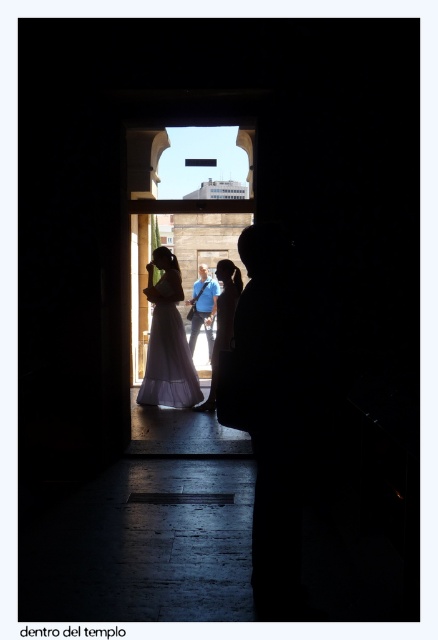
Question: Is white tulle dress at center to the left of blue fabric shirt at center from the viewer's perspective?

Choices:
 (A) no
 (B) yes

Answer: (B)

Question: Can you confirm if white tulle dress at center is thinner than blue fabric shirt at center?

Choices:
 (A) yes
 (B) no

Answer: (B)

Question: Can you confirm if white satin dress at center is thinner than blue fabric shirt at center?

Choices:
 (A) yes
 (B) no

Answer: (B)

Question: Which of the following is the farthest from the observer?

Choices:
 (A) white satin dress at center
 (B) blue fabric shirt at center
 (C) white tulle dress at center

Answer: (B)

Question: Based on their relative distances, which object is farther from the white tulle dress at center?

Choices:
 (A) blue fabric shirt at center
 (B) white satin dress at center

Answer: (A)

Question: Which point is farther from the camera taking this photo?

Choices:
 (A) (222, 308)
 (B) (209, 284)
 (C) (166, 336)

Answer: (B)